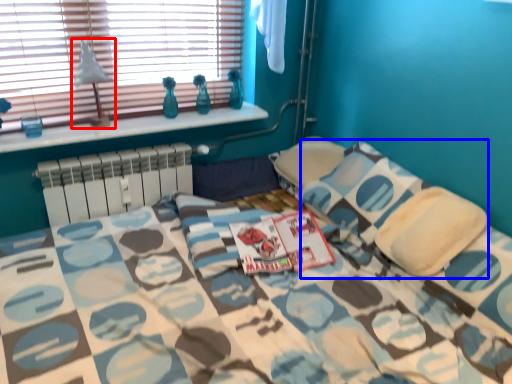
Question: Among these objects, which one is farthest to the camera, table lamp (highlighted by a red box) or pillow (highlighted by a blue box)?

Choices:
 (A) table lamp
 (B) pillow

Answer: (A)